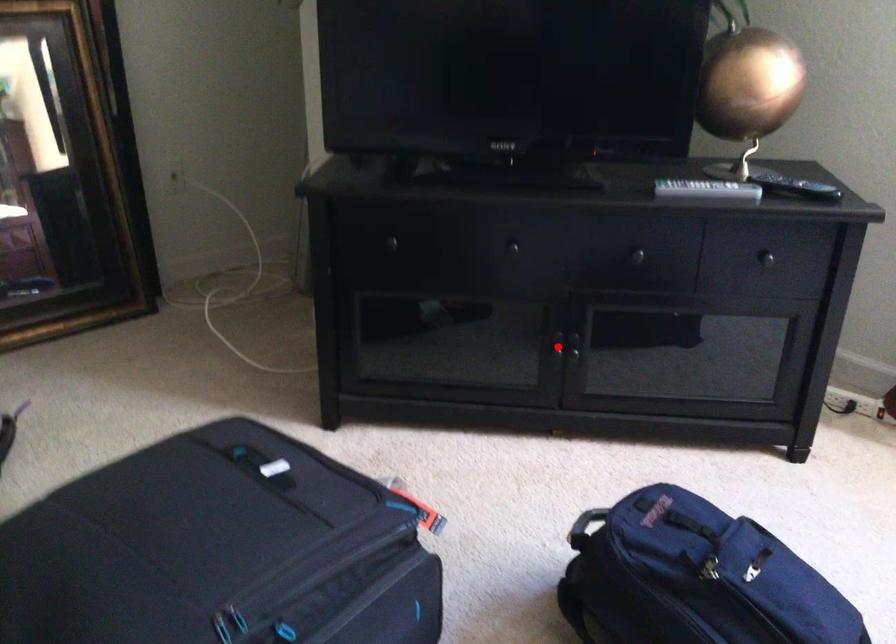
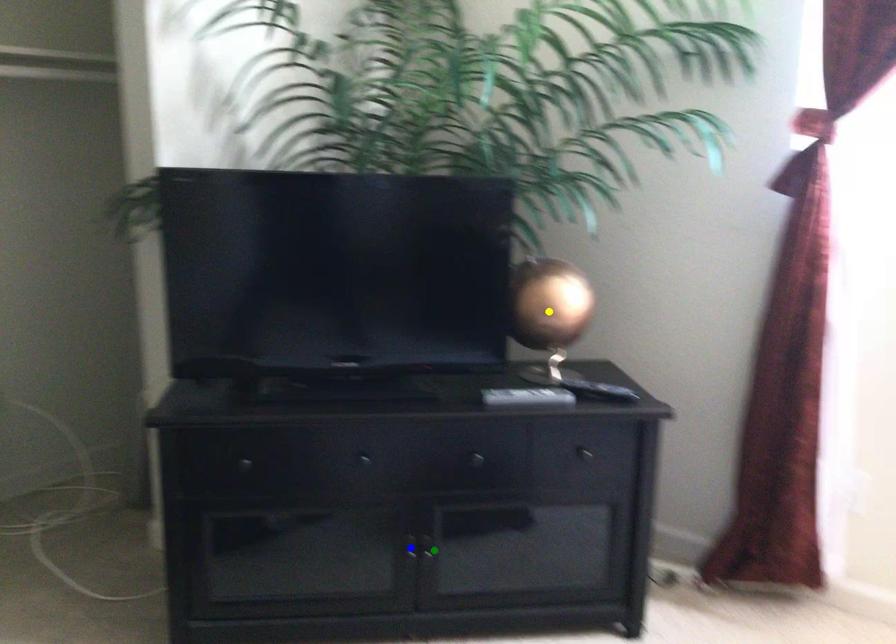
Question: I am providing you with two images of the same scene from different viewpoints. A red point is marked on the first image. You are given multiple points on the second image. Which spot in image 2 lines up with the point in image 1?

Choices:
 (A) yellow point
 (B) green point
 (C) blue point

Answer: (C)